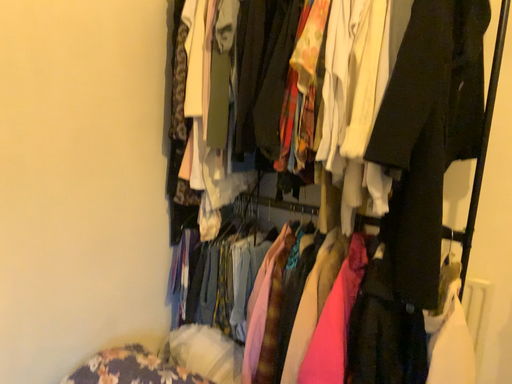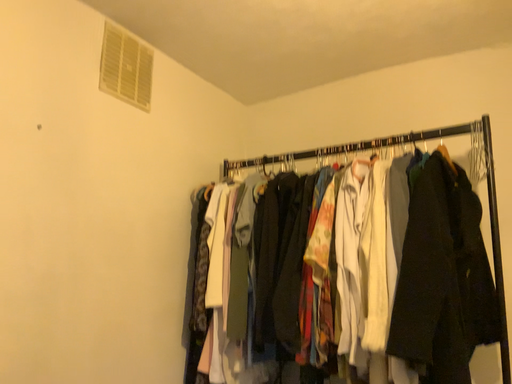
Question: How did the camera likely rotate when shooting the video?

Choices:
 (A) rotated upward
 (B) rotated downward

Answer: (A)